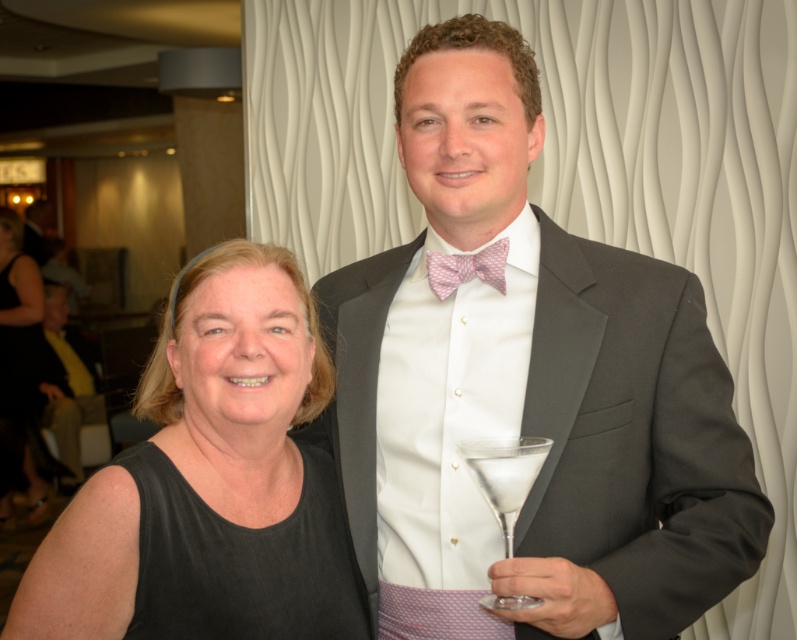
Does point (14, 625) lie behind point (485, 486)?

Yes, point (14, 625) is behind point (485, 486).

Which is above, black fabric at left or clear glass martini glass at right?

black fabric at left

Is point (315, 355) positioned after point (493, 502)?

Yes, it is.

You are a GUI agent. You are given a task and a screenshot of the screen. Output one action in this format:
    pyautogui.click(x=<x>, y=<y>)
    Task: Click on the black fabric at left
    The height and width of the screenshot is (640, 797).
    Given the screenshot: What is the action you would take?
    pyautogui.click(x=210, y=483)

Is matte gray suit at center further to camera compared to clear glass martini glass at right?

That is True.

Who is more forward, (351, 513) or (501, 448)?

Point (501, 448) is in front.

Is point (662, 580) farther from camera compared to point (497, 493)?

Yes, point (662, 580) is behind point (497, 493).

Image resolution: width=797 pixels, height=640 pixels. Identify the location of matte gray suit at center. (525, 388).

Which is below, matte gray suit at center or black dress at left?

black dress at left is below.

Who is more forward, (x=352, y=525) or (x=30, y=474)?

Positioned in front is point (x=352, y=525).

You are a GUI agent. You are given a task and a screenshot of the screen. Output one action in this format:
    pyautogui.click(x=<x>, y=<y>)
    Task: Click on the matte gray suit at center
    The image size is (797, 640).
    Given the screenshot: What is the action you would take?
    pyautogui.click(x=525, y=388)